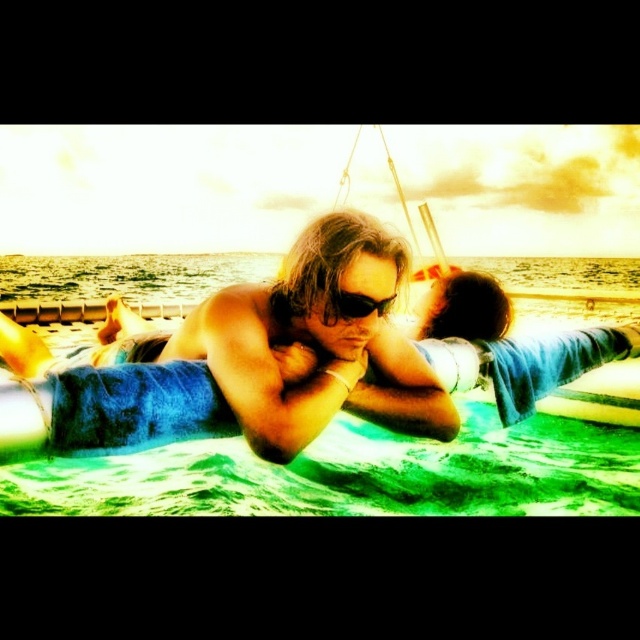
Is point (291, 355) positioned in front of point (340, 292)?

No, it is behind (340, 292).

Who is positioned more to the left, blue towel at center or black plastic goggles at center?

From the viewer's perspective, black plastic goggles at center appears more on the left side.

Who is more distant from viewer, (316, 362) or (337, 289)?

The point (316, 362) is more distant.

This screenshot has height=640, width=640. I want to click on blue towel at center, so click(x=280, y=364).